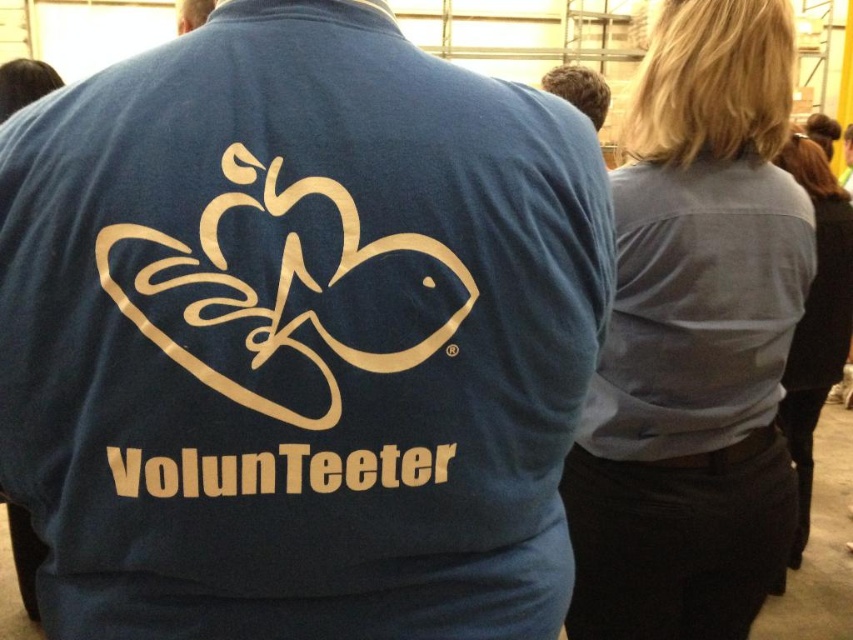
Question: Can you confirm if matte blue shirt at center is positioned below gold/smooth/swirl at upper center?

Choices:
 (A) yes
 (B) no

Answer: (A)

Question: Is gold/smooth/swirl at upper center positioned at the back of goldmaterial/texturevolunteeter at center?

Choices:
 (A) no
 (B) yes

Answer: (A)

Question: Is matte blue shirt at center further to camera compared to gold/smooth/swirl at upper center?

Choices:
 (A) yes
 (B) no

Answer: (A)

Question: Which object is positioned closest to the goldmaterial/texturevolunteeter at center?

Choices:
 (A) matte blue shirt at center
 (B) gold/smooth/swirl at upper center

Answer: (B)

Question: Which object is positioned closest to the goldmaterial/texturevolunteeter at center?

Choices:
 (A) matte blue shirt at center
 (B) gold/smooth/swirl at upper center

Answer: (B)

Question: Which object appears farthest from the camera in this image?

Choices:
 (A) goldmaterial/texturevolunteeter at center
 (B) matte blue shirt at center
 (C) gold/smooth/swirl at upper center

Answer: (A)